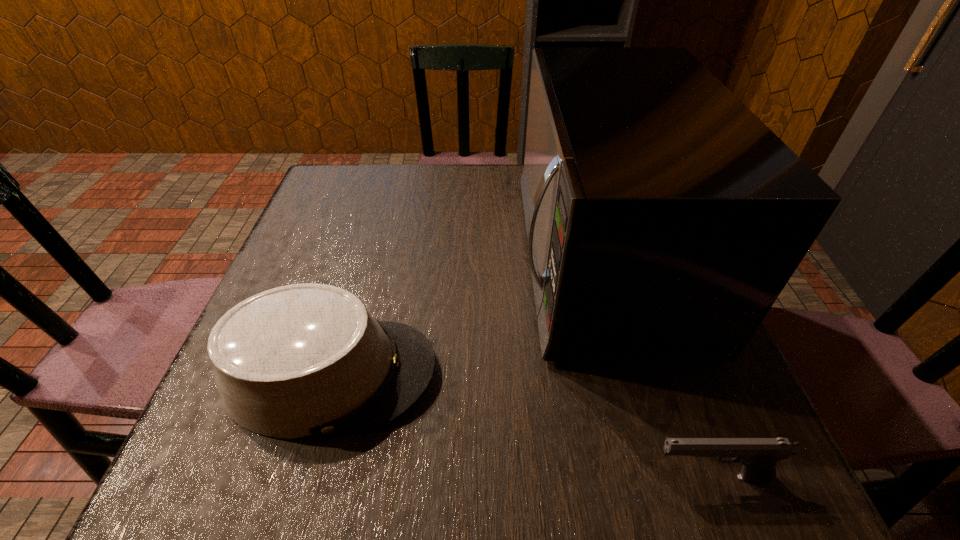
This screenshot has width=960, height=540. Find the location of `free space at the near edge of the desktop`. free space at the near edge of the desktop is located at coordinates (398, 438).

You are a GUI agent. You are given a task and a screenshot of the screen. Output one action in this format:
    pyautogui.click(x=<x>, y=<y>)
    Task: Click on the free space at the left edge
    The height and width of the screenshot is (540, 960).
    Given the screenshot: What is the action you would take?
    pyautogui.click(x=331, y=251)

The height and width of the screenshot is (540, 960). In the image, there is a desktop. In order to click on vacant space at the near left corner in this screenshot , I will do `click(246, 478)`.

You are a GUI agent. You are given a task and a screenshot of the screen. Output one action in this format:
    pyautogui.click(x=<x>, y=<y>)
    Task: Click on the free space at the near right corner
    The height and width of the screenshot is (540, 960).
    Given the screenshot: What is the action you would take?
    (732, 475)

In order to click on empty space that is in between the leftmost object and the pistol in this screenshot , I will do `click(520, 425)`.

You are a GUI agent. You are given a task and a screenshot of the screen. Output one action in this format:
    pyautogui.click(x=<x>, y=<y>)
    Task: Click on the empty space that is in between the leftmost object and the tallest object
    The height and width of the screenshot is (540, 960).
    Given the screenshot: What is the action you would take?
    pyautogui.click(x=465, y=316)

Locate an element on the screen. free space between the nearest object and the microwave oven is located at coordinates (654, 368).

The image size is (960, 540). Find the location of `vacant space that is in between the pistol and the tallest object`. vacant space that is in between the pistol and the tallest object is located at coordinates (654, 368).

Identify the location of vacant space that is in between the microwave oven and the leftmost object. tap(465, 316).

You are a GUI agent. You are given a task and a screenshot of the screen. Output one action in this format:
    pyautogui.click(x=<x>, y=<y>)
    Task: Click on the free space between the microwave oven and the leftmost object
    The image size is (960, 540).
    Given the screenshot: What is the action you would take?
    pyautogui.click(x=465, y=316)